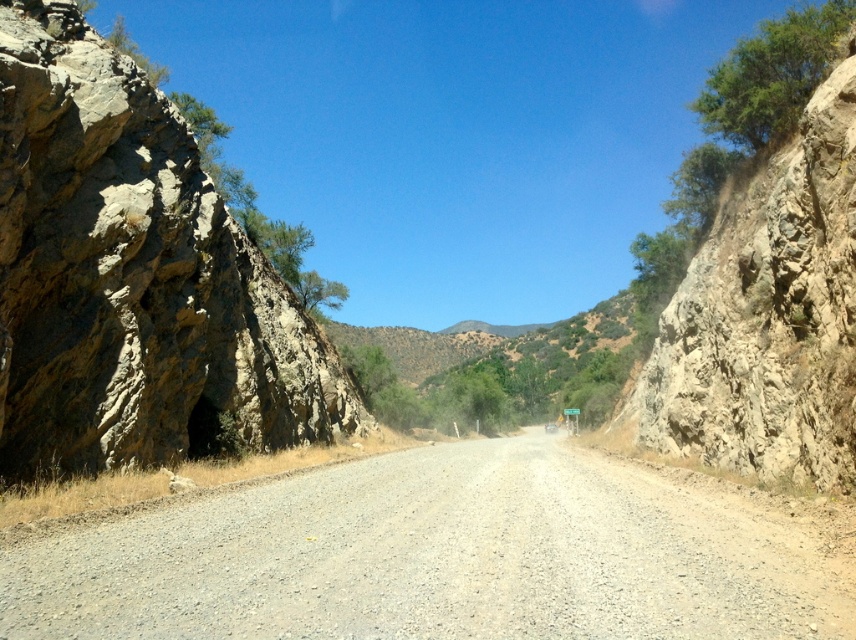
Question: Does rusty rock formation at left appear under rugged stone cliff at right?

Choices:
 (A) yes
 (B) no

Answer: (A)

Question: Which of these objects is positioned farthest from the rugged stone cliff at right?

Choices:
 (A) rusty rock formation at left
 (B) gray gravel road at center

Answer: (A)

Question: Is gray gravel road at center below rugged stone cliff at right?

Choices:
 (A) yes
 (B) no

Answer: (A)

Question: Which point appears farthest from the camera in this image?

Choices:
 (A) (827, 172)
 (B) (278, 356)
 (C) (611, 624)

Answer: (B)

Question: Can you confirm if rusty rock formation at left is thinner than rugged stone cliff at right?

Choices:
 (A) no
 (B) yes

Answer: (B)

Question: Which point appears farthest from the camera in this image?

Choices:
 (A) (119, 195)
 (B) (449, 592)

Answer: (A)